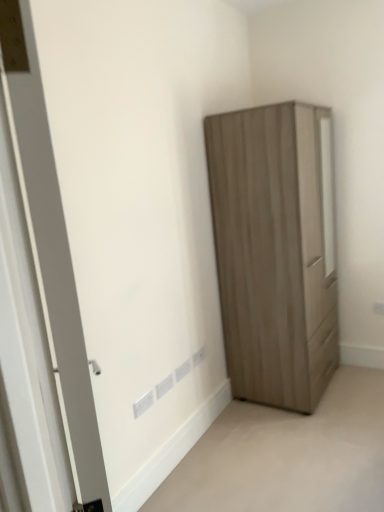
Image resolution: width=384 pixels, height=512 pixels. Describe the element at coordinates (288, 455) in the screenshot. I see `matte wood wardrobe at lower right` at that location.

The image size is (384, 512). Identify the location of matte wood wardrobe at right. [x=275, y=250].

Image resolution: width=384 pixels, height=512 pixels. What do you see at coordinates (143, 404) in the screenshot? I see `white plastic electric outlet at lower center` at bounding box center [143, 404].

Image resolution: width=384 pixels, height=512 pixels. Identify the location of matte wood wardrobe at lower right. (288, 455).

Between white plastic electric outlet at lower center and white matte door at left, which one has smaller width?

Thinner between the two is white plastic electric outlet at lower center.

Would you say white plastic electric outlet at lower center contains white matte door at left?

No.

Is white plastic electric outlet at lower center behind white matte door at left?

Yes.

Is white plastic electric outlet at lower center not near white matte door at left?

Yes, white plastic electric outlet at lower center and white matte door at left are quite far apart.

From a real-world perspective, is matte wood wardrobe at right positioned under white plastic electric outlet at lower center based on gravity?

Incorrect, from a real-world perspective, matte wood wardrobe at right is higher than white plastic electric outlet at lower center.

Where is `cupboard behind the white plastic electric outlet at lower center`? The image size is (384, 512). cupboard behind the white plastic electric outlet at lower center is located at coordinates (275, 250).

Could you tell me if matte wood wardrobe at right is turned towards white plastic electric outlet at lower center?

No, matte wood wardrobe at right does not turn towards white plastic electric outlet at lower center.

From the image's perspective, does matte wood wardrobe at right appear lower than white plastic electric outlet at lower center?

Actually, matte wood wardrobe at right appears above white plastic electric outlet at lower center in the image.

From a real-world perspective, is matte wood wardrobe at right located higher than matte wood wardrobe at lower right?

Yes.

From the image's perspective, between matte wood wardrobe at right and matte wood wardrobe at lower right, which one is located above?

matte wood wardrobe at right is shown above in the image.

Does matte wood wardrobe at right have a lesser height compared to matte wood wardrobe at lower right?

No, matte wood wardrobe at right is not shorter than matte wood wardrobe at lower right.

Is matte wood wardrobe at right aimed at matte wood wardrobe at lower right?

No, matte wood wardrobe at right does not turn towards matte wood wardrobe at lower right.

How many degrees apart are the facing directions of matte wood wardrobe at lower right and matte wood wardrobe at right?

88.5 degrees.

In the scene shown: Is matte wood wardrobe at lower right situated inside matte wood wardrobe at right or outside?

matte wood wardrobe at lower right is not enclosed by matte wood wardrobe at right.

Where is `corridor in front of the matte wood wardrobe at right`? This screenshot has width=384, height=512. corridor in front of the matte wood wardrobe at right is located at coordinates (288, 455).

Is matte wood wardrobe at lower right oriented away from matte wood wardrobe at right?

No.

The width and height of the screenshot is (384, 512). Identify the location of corridor below the white plastic electric outlet at lower center (from the image's perspective). (288, 455).

Is white plastic electric outlet at lower center not close to matte wood wardrobe at lower right?

That's not correct — white plastic electric outlet at lower center is a little close to matte wood wardrobe at lower right.

Based on the photo, considering the sizes of objects white plastic electric outlet at lower center and matte wood wardrobe at lower right in the image provided, who is shorter, white plastic electric outlet at lower center or matte wood wardrobe at lower right?

With less height is matte wood wardrobe at lower right.

Is matte wood wardrobe at right positioned with its back to white matte door at left?

matte wood wardrobe at right does not have its back to white matte door at left.

Which object is closer to the camera taking this photo, matte wood wardrobe at right or white matte door at left?

Positioned in front is white matte door at left.

Considering the points (301, 270) and (64, 283), which point is in front, point (301, 270) or point (64, 283)?

The point (64, 283) is more forward.

Considering the relative sizes of matte wood wardrobe at right and white matte door at left in the image provided, is matte wood wardrobe at right wider than white matte door at left?

Indeed, matte wood wardrobe at right has a greater width compared to white matte door at left.

Does point (94, 470) lie in front of point (229, 291)?

Yes, point (94, 470) is in front of point (229, 291).

Based on the photo, from a real-world perspective, which is physically below, white matte door at left or matte wood wardrobe at right?

matte wood wardrobe at right, from a real-world perspective.

How far apart are white matte door at left and matte wood wardrobe at right?

The distance of white matte door at left from matte wood wardrobe at right is 2.01 meters.

Does white matte door at left have a larger size compared to matte wood wardrobe at right?

No.

This screenshot has width=384, height=512. What are the coordinates of `electric outlet below the white matte door at left (from a real-world perspective)` in the screenshot? It's located at (143, 404).

This screenshot has height=512, width=384. I want to click on cupboard that appears on the right of white plastic electric outlet at lower center, so click(x=275, y=250).

When comparing their distances from matte wood wardrobe at right, does matte wood wardrobe at lower right or white matte door at left seem closer?

The object closer to matte wood wardrobe at right is matte wood wardrobe at lower right.

Looking at the image, which one is located closer to white matte door at left, matte wood wardrobe at right or matte wood wardrobe at lower right?

matte wood wardrobe at lower right is positioned closer to the anchor white matte door at left.

Looking at the image, which one is located further to white plastic electric outlet at lower center, matte wood wardrobe at lower right or white matte door at left?

The object further to white plastic electric outlet at lower center is white matte door at left.

From the image, which object appears to be nearer to white matte door at left, matte wood wardrobe at lower right or matte wood wardrobe at right?

matte wood wardrobe at lower right is positioned closer to the anchor white matte door at left.

Estimate the real-world distances between objects in this image. Which object is further from matte wood wardrobe at lower right, white matte door at left or white plastic electric outlet at lower center?

Based on the image, white matte door at left appears to be further to matte wood wardrobe at lower right.

Considering their positions, is matte wood wardrobe at right positioned closer to white plastic electric outlet at lower center than matte wood wardrobe at lower right?

Among the two, matte wood wardrobe at lower right is located nearer to white plastic electric outlet at lower center.

Which object lies nearer to the anchor point white matte door at left, white plastic electric outlet at lower center or matte wood wardrobe at right?

white plastic electric outlet at lower center is positioned closer to the anchor white matte door at left.

Which object lies further to the anchor point matte wood wardrobe at lower right, matte wood wardrobe at right or white matte door at left?

white matte door at left is positioned further to the anchor matte wood wardrobe at lower right.

The image size is (384, 512). In order to click on corridor between white matte door at left and matte wood wardrobe at right in the front-back direction in this screenshot , I will do `click(288, 455)`.

Locate an element on the screen. This screenshot has height=512, width=384. electric outlet located between white matte door at left and matte wood wardrobe at right in the depth direction is located at coordinates (143, 404).

Locate an element on the screen. corridor positioned between white matte door at left and white plastic electric outlet at lower center from near to far is located at coordinates (288, 455).

This screenshot has width=384, height=512. I want to click on electric outlet between matte wood wardrobe at right and matte wood wardrobe at lower right vertically, so click(x=143, y=404).